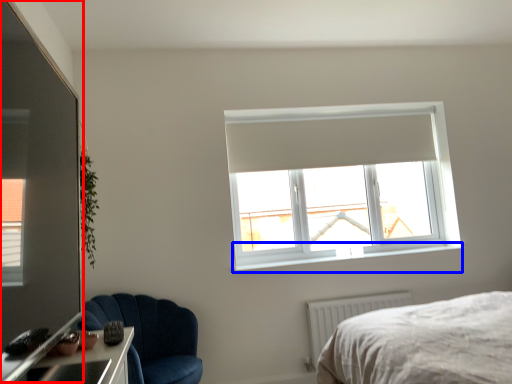
Question: Which of the following is the farthest to the observer, glass door (highlighted by a red box) or window sill (highlighted by a blue box)?

Choices:
 (A) glass door
 (B) window sill

Answer: (B)